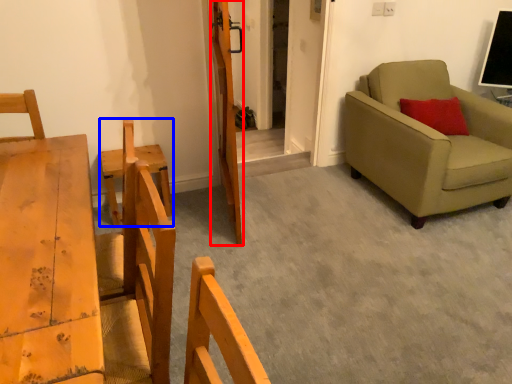
Question: Which object appears closest to the camera in this image, door (highlighted by a red box) or armchair (highlighted by a blue box)?

Choices:
 (A) door
 (B) armchair

Answer: (A)